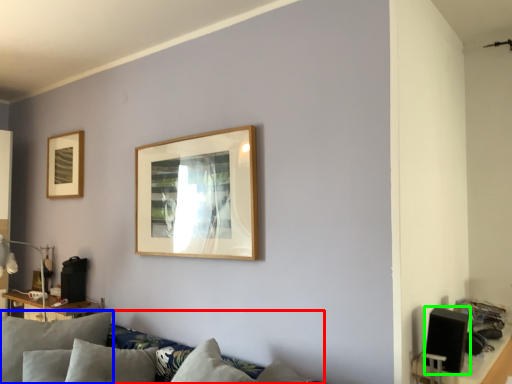
Question: Which object is positioned closest to couch (highlighted by a red box)? Select from pillow (highlighted by a blue box) and speaker (highlighted by a green box).

Choices:
 (A) pillow
 (B) speaker

Answer: (A)